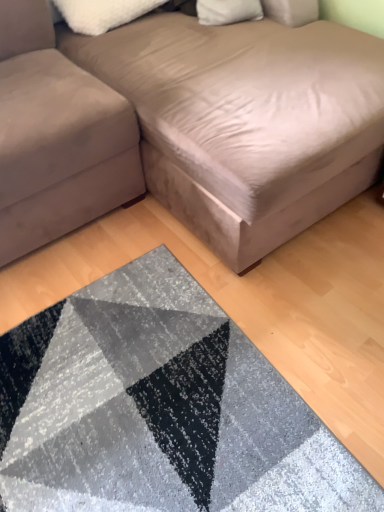
Question: Could you tell me if white fluffy pillow at upper center is turned towards suede-like beige couch at lower left, marked as the 2th studio couch in a right-to-left arrangement?

Choices:
 (A) no
 (B) yes

Answer: (A)

Question: Is white fluffy pillow at upper center facing away from suede-like beige couch at lower left, marked as the 2th studio couch in a right-to-left arrangement?

Choices:
 (A) yes
 (B) no

Answer: (B)

Question: Does white fluffy pillow at upper center appear on the left side of suede-like beige couch at lower left, which is the 1th studio couch in left-to-right order?

Choices:
 (A) no
 (B) yes

Answer: (A)

Question: Does white fluffy pillow at upper center have a larger size compared to suede-like beige couch at lower left, which is the 1th studio couch in left-to-right order?

Choices:
 (A) no
 (B) yes

Answer: (A)

Question: Is white fluffy pillow at upper center closer to camera compared to suede-like beige couch at lower left, which is the 1th studio couch in left-to-right order?

Choices:
 (A) yes
 (B) no

Answer: (B)

Question: Is white fluffy pillow at upper center wider than suede-like beige couch at lower left, which is the 1th studio couch in left-to-right order?

Choices:
 (A) yes
 (B) no

Answer: (B)

Question: Are suede-like beige couch at lower left, marked as the 2th studio couch in a right-to-left arrangement, and white fluffy pillow at upper center making contact?

Choices:
 (A) no
 (B) yes

Answer: (A)

Question: Is suede-like beige couch at lower left, marked as the 2th studio couch in a right-to-left arrangement, shorter than white fluffy pillow at upper center?

Choices:
 (A) no
 (B) yes

Answer: (A)

Question: Is suede-like beige couch at lower left, marked as the 2th studio couch in a right-to-left arrangement, wider than white fluffy pillow at upper center?

Choices:
 (A) yes
 (B) no

Answer: (A)

Question: Is suede-like beige couch at lower left, marked as the 2th studio couch in a right-to-left arrangement, outside of white fluffy pillow at upper center?

Choices:
 (A) yes
 (B) no

Answer: (A)

Question: From the image's perspective, does suede-like beige couch at lower left, marked as the 2th studio couch in a right-to-left arrangement, appear higher than white fluffy pillow at upper center?

Choices:
 (A) no
 (B) yes

Answer: (A)

Question: Is suede-like beige couch at lower left, marked as the 2th studio couch in a right-to-left arrangement, smaller than white fluffy pillow at upper center?

Choices:
 (A) no
 (B) yes

Answer: (A)

Question: Is suede-like beige studio couch at upper center, acting as the second studio couch starting from the left, beside suede-like beige couch at lower left, marked as the 2th studio couch in a right-to-left arrangement?

Choices:
 (A) no
 (B) yes

Answer: (A)